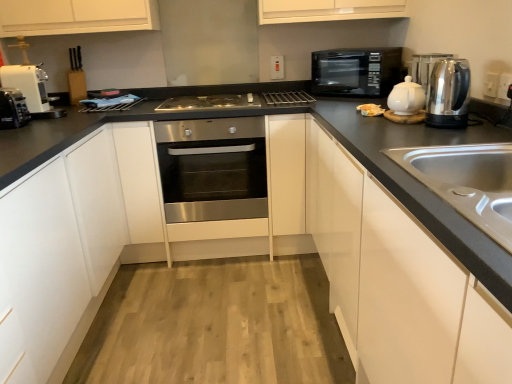
Identify the location of free space to the left of polished stainless steel kettle at right. (390, 132).